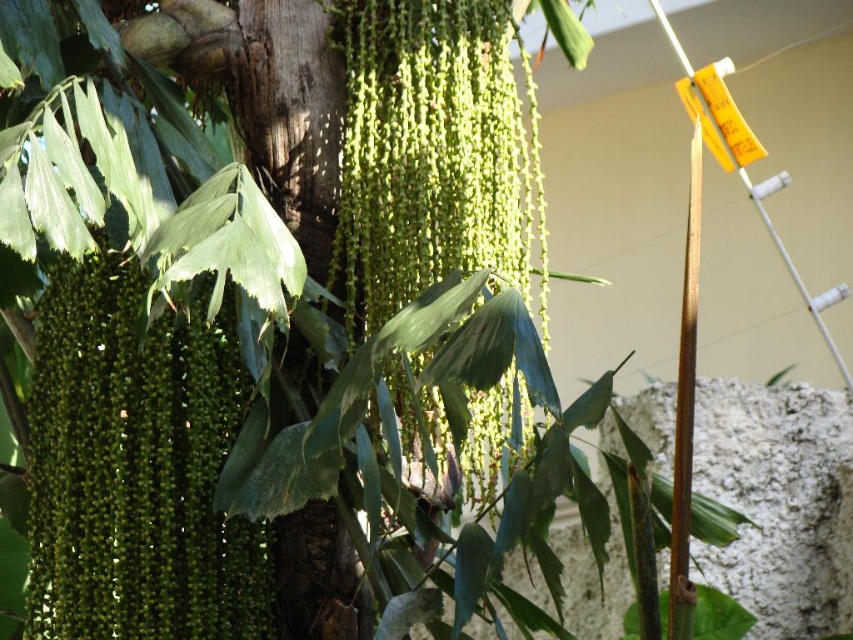
Question: Can you confirm if green matte seeds at center is positioned below green textured tree trunk at center?

Choices:
 (A) no
 (B) yes

Answer: (B)

Question: Which of the following is the farthest from the observer?

Choices:
 (A) green matte seeds at center
 (B) green textured tree trunk at center

Answer: (B)

Question: Which object is closer to the camera taking this photo?

Choices:
 (A) green matte seeds at center
 (B) green textured tree trunk at center

Answer: (A)

Question: Can you confirm if green matte seeds at center is bigger than green textured tree trunk at center?

Choices:
 (A) no
 (B) yes

Answer: (B)

Question: Can you confirm if green matte seeds at center is thinner than green textured tree trunk at center?

Choices:
 (A) yes
 (B) no

Answer: (B)